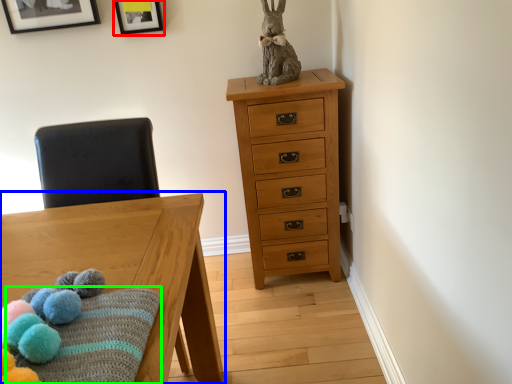
Question: Which object is the closest to the picture frame (highlighted by a red box)? Choose among these: table (highlighted by a blue box) or blanket (highlighted by a green box).

Choices:
 (A) table
 (B) blanket

Answer: (A)